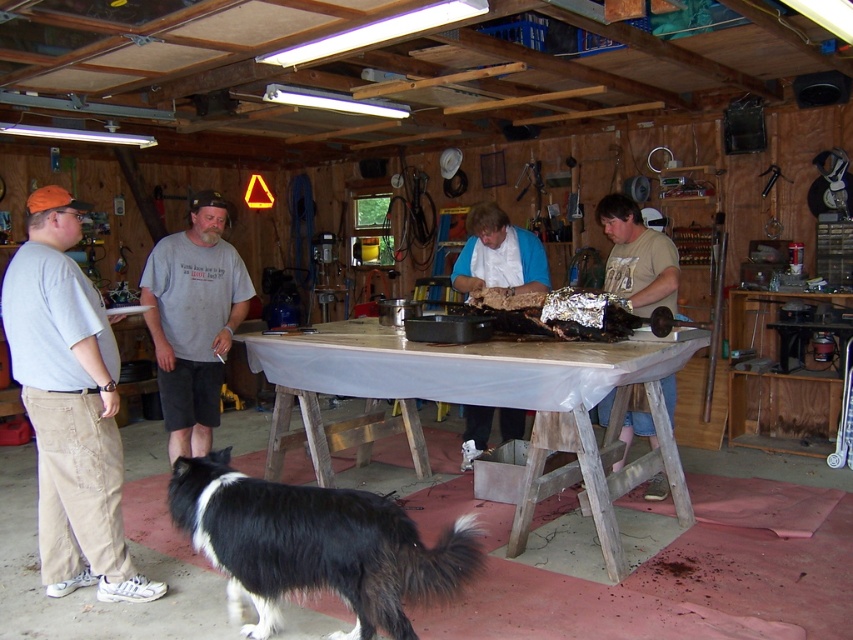
Question: Which object appears closest to the camera in this image?

Choices:
 (A) matte brown shirt at center
 (B) blue fabric shirt at center
 (C) shiny aluminum foil at center

Answer: (C)

Question: Can you confirm if khaki cotton pants at left is smaller than gray cotton shirt at center?

Choices:
 (A) yes
 (B) no

Answer: (A)

Question: Is wooden table at center wider than black and white fur at lower left?

Choices:
 (A) yes
 (B) no

Answer: (A)

Question: Among these points, which one is nearest to the camera?

Choices:
 (A) (643, 262)
 (B) (471, 419)

Answer: (A)

Question: Can you confirm if khaki cotton pants at left is positioned to the left of blue fabric shirt at center?

Choices:
 (A) yes
 (B) no

Answer: (A)

Question: Based on their relative distances, which object is nearer to the matte brown shirt at center?

Choices:
 (A) khaki cotton pants at left
 (B) black and white fur at lower left

Answer: (B)